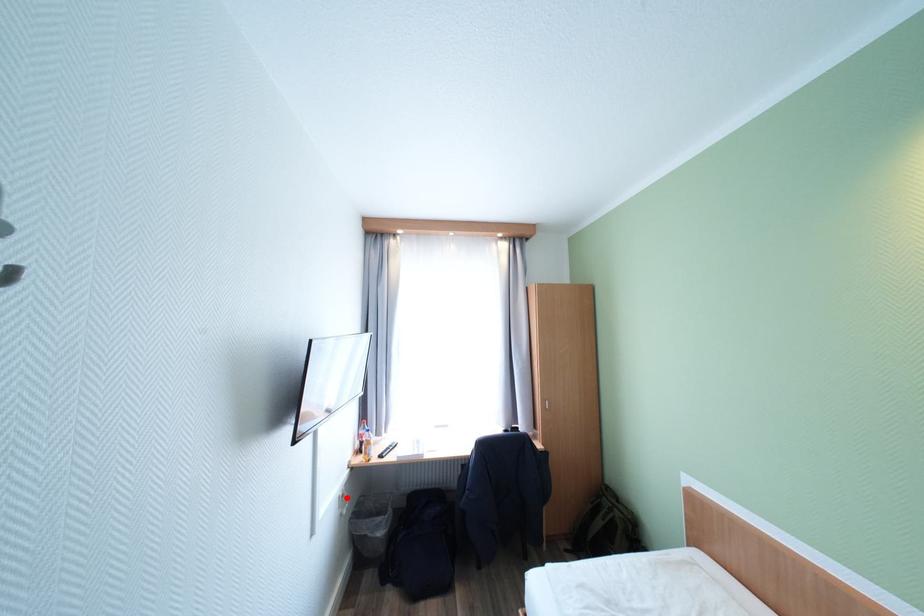
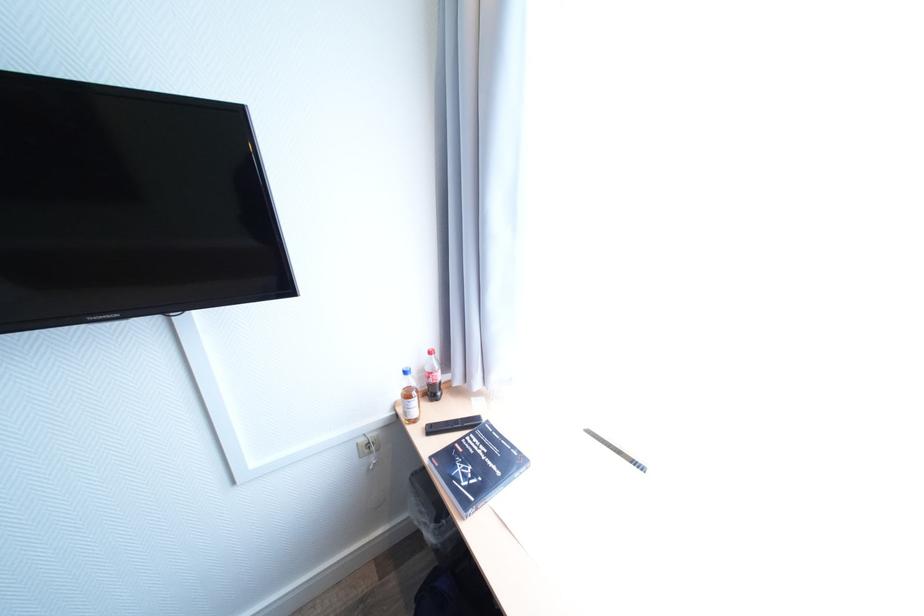
The point at the highlighted location is marked in the first image. Where is the corresponding point in the second image?

(365, 445)